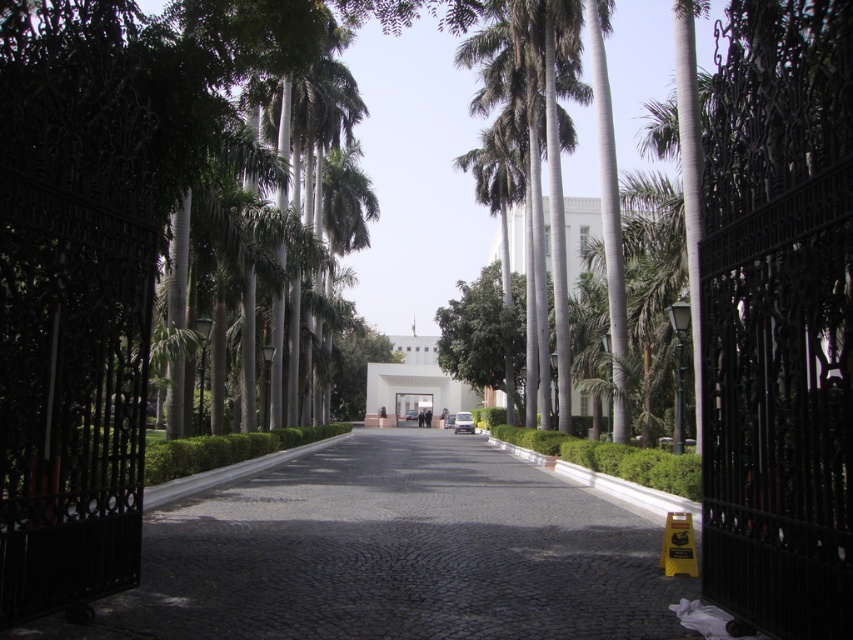
Question: Is cobblestone pavement at center above green leafy palm tree at center?

Choices:
 (A) yes
 (B) no

Answer: (B)

Question: Which of the following is the farthest from the observer?

Choices:
 (A) (227, 518)
 (B) (527, 65)

Answer: (B)

Question: Is the position of cobblestone pavement at center more distant than that of green leafy palm tree at center?

Choices:
 (A) yes
 (B) no

Answer: (B)

Question: Which object is farther from the camera taking this photo?

Choices:
 (A) green leafy palm tree at center
 (B) cobblestone pavement at center

Answer: (A)

Question: Can you confirm if cobblestone pavement at center is positioned above green leafy palm tree at center?

Choices:
 (A) no
 (B) yes

Answer: (A)

Question: Which of the following is the farthest from the observer?

Choices:
 (A) cobblestone pavement at center
 (B) green leafy palm tree at center

Answer: (B)